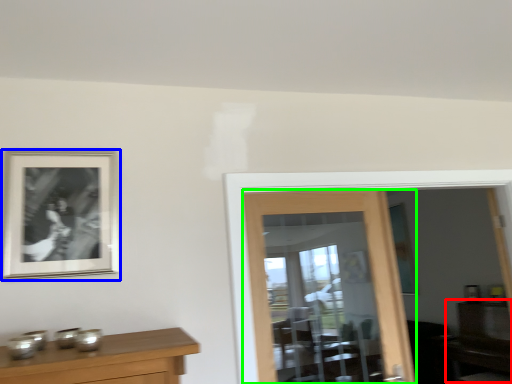
Question: Which object is the farthest from dresser (highlighted by a red box)? Choose among these: picture frame (highlighted by a blue box) or door (highlighted by a green box).

Choices:
 (A) picture frame
 (B) door

Answer: (A)